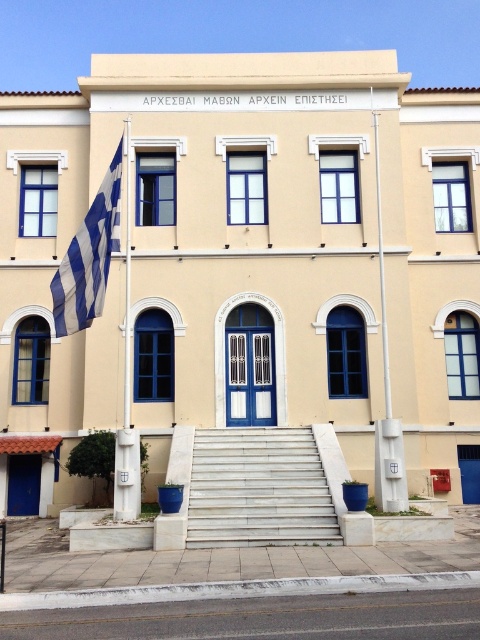
Can you confirm if white concrete stairs at center is shorter than white plastic flag pole at upper center?

Yes, white concrete stairs at center is shorter than white plastic flag pole at upper center.

Is point (292, 534) farther from camera compared to point (375, 147)?

No, (292, 534) is closer to viewer.

Is point (286, 484) farther from camera compared to point (389, 392)?

No.

Locate an element on the screen. This screenshot has height=640, width=480. white concrete stairs at center is located at coordinates (263, 486).

Is beige stucco building at center bigger than white painted metal flag pole at left?

Indeed, beige stucco building at center has a larger size compared to white painted metal flag pole at left.

Between beige stucco building at center and white painted metal flag pole at left, which one appears on the left side from the viewer's perspective?

white painted metal flag pole at left

Who is more distant from viewer, (84, 108) or (124, 380)?

Point (84, 108)

Locate an element on the screen. The image size is (480, 640). beige stucco building at center is located at coordinates (244, 260).

Can you confirm if beige stucco building at center is smaller than white concrete stairs at center?

No, beige stucco building at center is not smaller than white concrete stairs at center.

Does point (252, 380) come in front of point (225, 460)?

No, it is not.

Image resolution: width=480 pixels, height=640 pixels. Identify the location of beige stucco building at center. (244, 260).